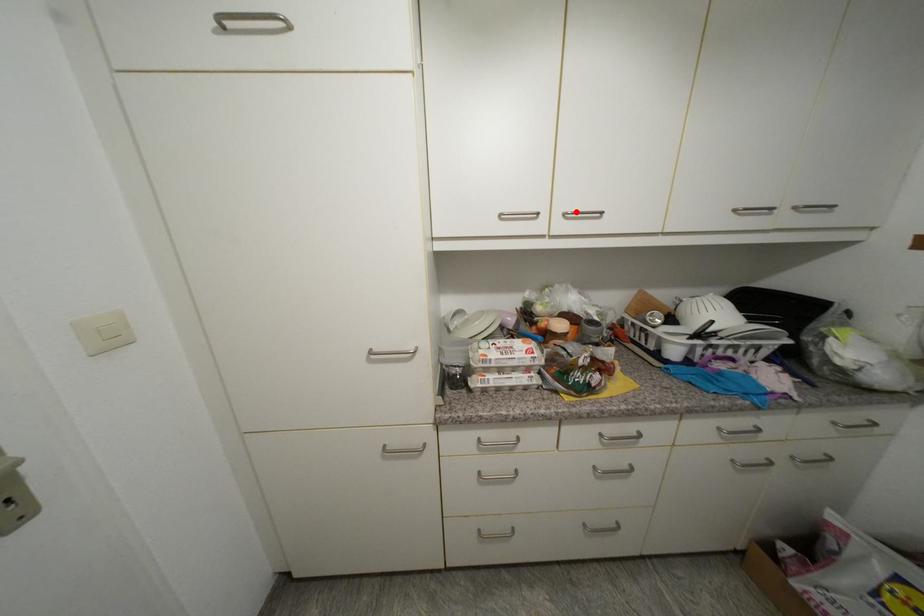
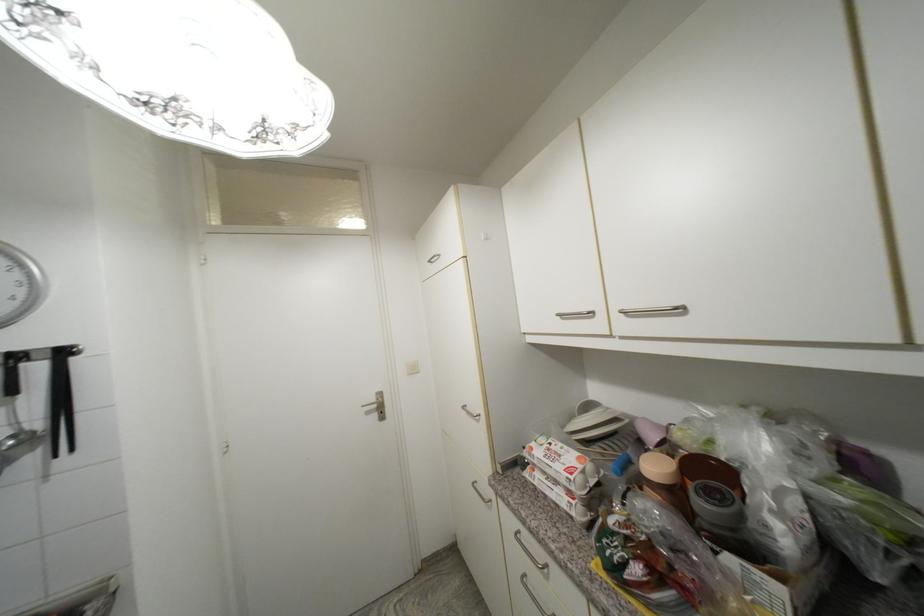
In the second image, find the point that corresponds to the highlighted location in the first image.

(631, 309)